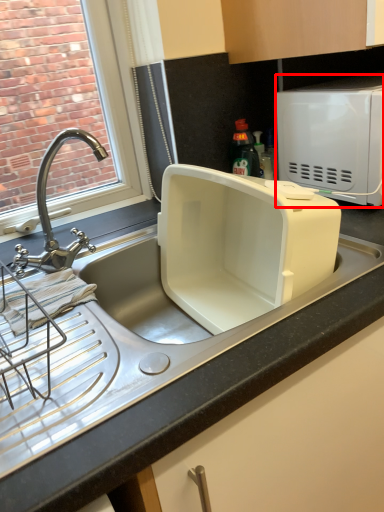
Question: In this image, where is microwave oven (annotated by the red box) located relative to tap?

Choices:
 (A) right
 (B) left

Answer: (A)